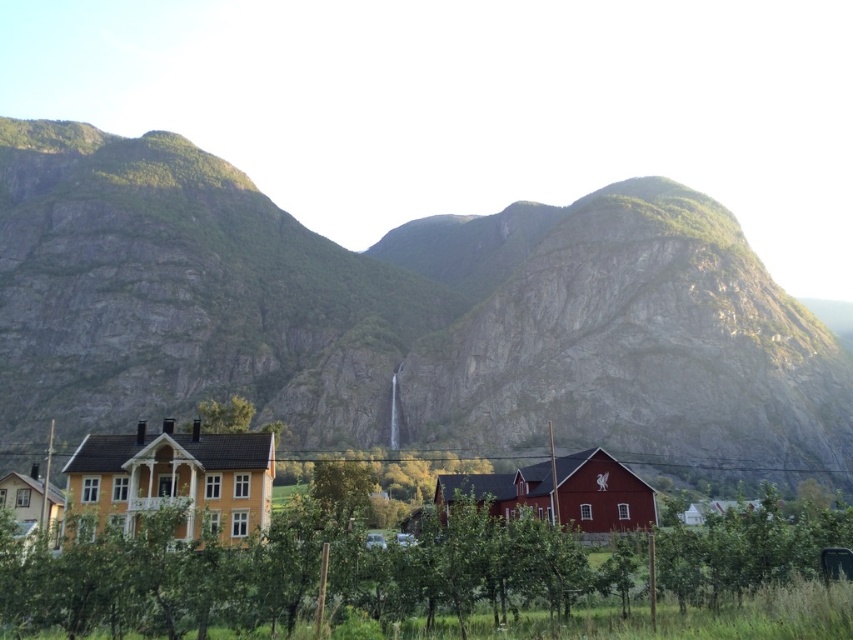
Who is shorter, rough stone mountain at center or green leafy tree at center?

green leafy tree at center

Does rough stone mountain at center have a lesser width compared to green leafy tree at center?

Incorrect, rough stone mountain at center's width is not less than green leafy tree at center's.

Is point (357, 317) closer to viewer compared to point (459, 625)?

No, it is behind (459, 625).

At what (x,y) coordinates should I click in order to perform the action: click on rough stone mountain at center. Please return your answer as a coordinate pair (x, y). The image size is (853, 640). Looking at the image, I should click on (401, 316).